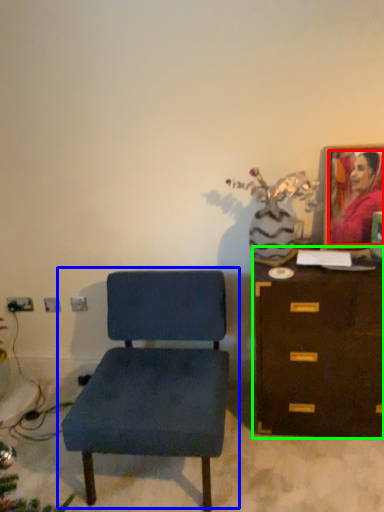
Question: Based on their relative distances, which object is farther from person (highlighted by a red box)? Choose from chair (highlighted by a blue box) and chest of drawers (highlighted by a green box).

Choices:
 (A) chair
 (B) chest of drawers

Answer: (A)